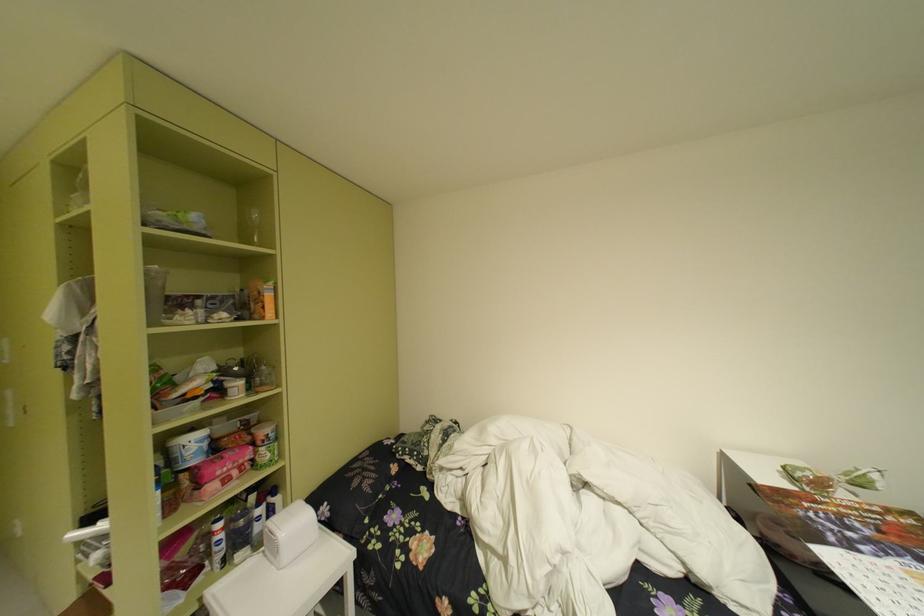
Where would you lift the pink food package? Please return your answer as a coordinate pair (x, y).

(220, 464)